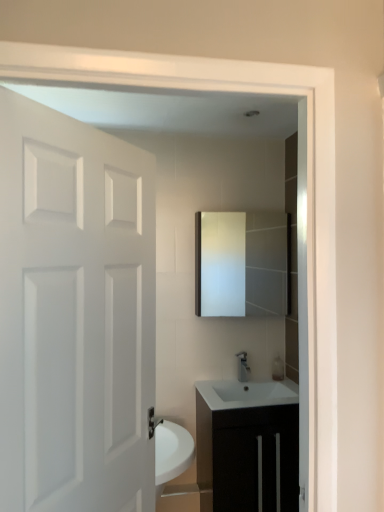
Question: From the image's perspective, does satin nickel faucet at center appear higher than white matte door at left?

Choices:
 (A) no
 (B) yes

Answer: (A)

Question: Does satin nickel faucet at center lie in front of white matte door at left?

Choices:
 (A) yes
 (B) no

Answer: (B)

Question: Is satin nickel faucet at center facing towards white matte door at left?

Choices:
 (A) no
 (B) yes

Answer: (A)

Question: Is satin nickel faucet at center at the left side of white matte door at left?

Choices:
 (A) yes
 (B) no

Answer: (B)

Question: Is satin nickel faucet at center smaller than white matte door at left?

Choices:
 (A) yes
 (B) no

Answer: (A)

Question: Which is correct: matte white mirror at center is inside satin nickel faucet at center, or outside of it?

Choices:
 (A) inside
 (B) outside

Answer: (B)

Question: Is point (276, 253) positioned closer to the camera than point (240, 362)?

Choices:
 (A) closer
 (B) farther

Answer: (B)

Question: Would you say matte white mirror at center is to the left or to the right of satin nickel faucet at center in the picture?

Choices:
 (A) right
 (B) left

Answer: (B)

Question: Looking at the image, does matte white mirror at center seem bigger or smaller compared to satin nickel faucet at center?

Choices:
 (A) small
 (B) big

Answer: (B)

Question: Considering the relative positions of white matte door at left and satin nickel faucet at center in the image provided, is white matte door at left to the left or to the right of satin nickel faucet at center?

Choices:
 (A) right
 (B) left

Answer: (B)

Question: Considering the positions of white matte door at left and satin nickel faucet at center in the image, is white matte door at left wider or thinner than satin nickel faucet at center?

Choices:
 (A) thin
 (B) wide

Answer: (B)

Question: From the image's perspective, is white matte door at left positioned above or below satin nickel faucet at center?

Choices:
 (A) above
 (B) below

Answer: (A)

Question: In terms of size, does white matte door at left appear bigger or smaller than satin nickel faucet at center?

Choices:
 (A) big
 (B) small

Answer: (A)

Question: Considering the positions of point pyautogui.click(x=49, y=236) and point pyautogui.click(x=259, y=250), is point pyautogui.click(x=49, y=236) closer or farther from the camera than point pyautogui.click(x=259, y=250)?

Choices:
 (A) farther
 (B) closer

Answer: (B)

Question: From a real-world perspective, is white matte door at left above or below matte white mirror at center?

Choices:
 (A) above
 (B) below

Answer: (B)